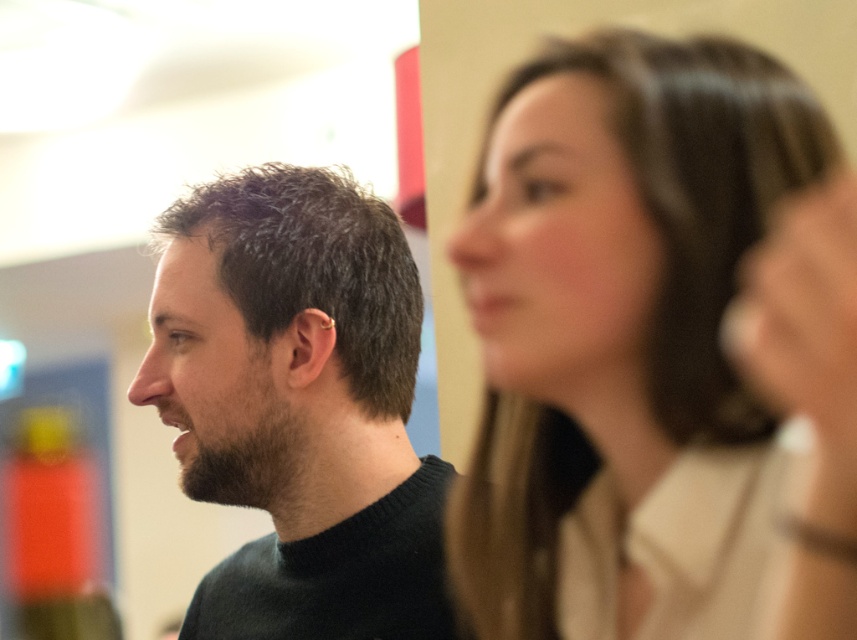
Question: Can you confirm if smooth beige blouse at upper right is wider than dark green sweater at left?

Choices:
 (A) no
 (B) yes

Answer: (A)

Question: Does smooth beige blouse at upper right have a greater width compared to dark green sweater at left?

Choices:
 (A) no
 (B) yes

Answer: (A)

Question: Among these objects, which one is nearest to the camera?

Choices:
 (A) smooth beige blouse at upper right
 (B) dark green sweater at left

Answer: (A)

Question: Which point is farther to the camera?

Choices:
 (A) smooth beige blouse at upper right
 (B) dark green sweater at left

Answer: (B)

Question: Can you confirm if smooth beige blouse at upper right is positioned to the right of dark green sweater at left?

Choices:
 (A) no
 (B) yes

Answer: (B)